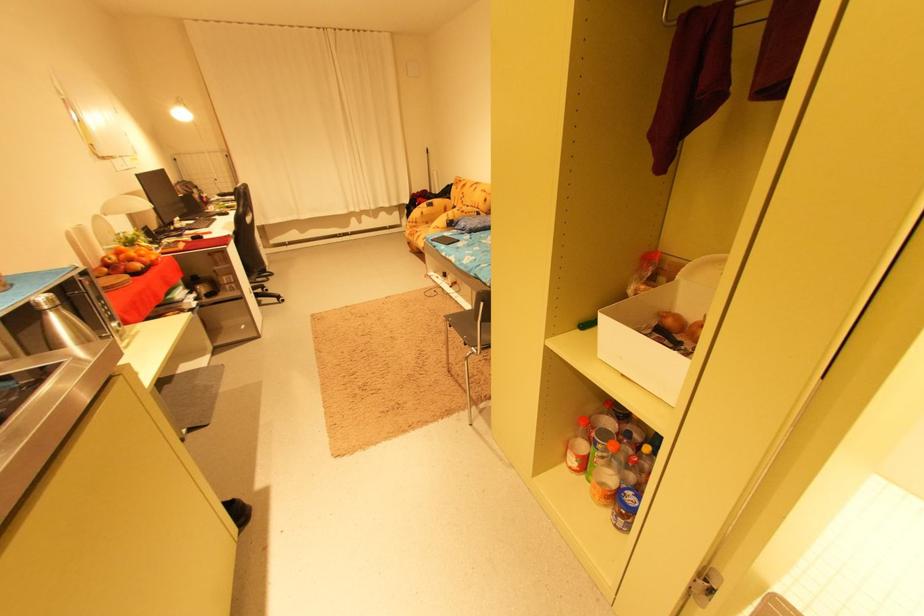
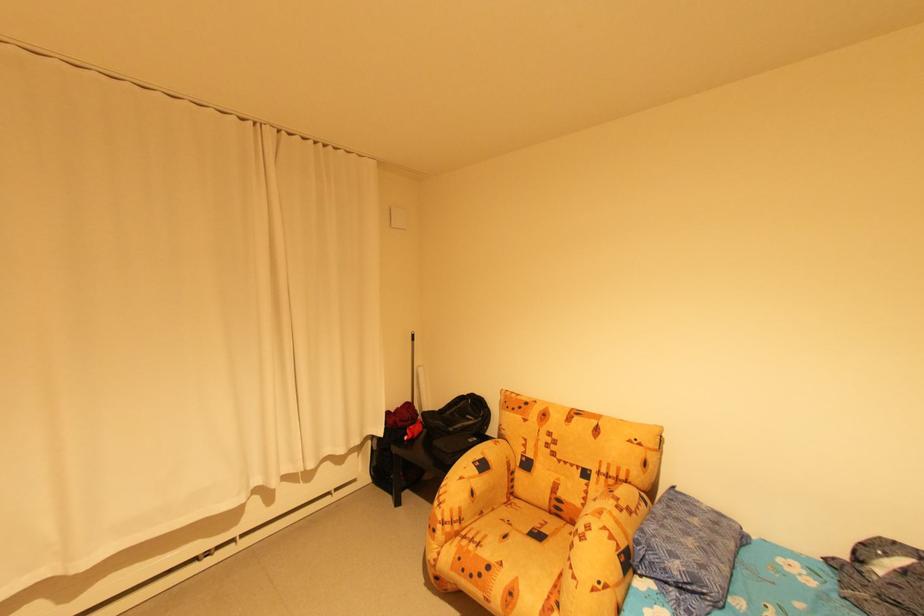
Locate, in the second image, the point that corresponds to point (426, 229) in the first image.

(485, 545)